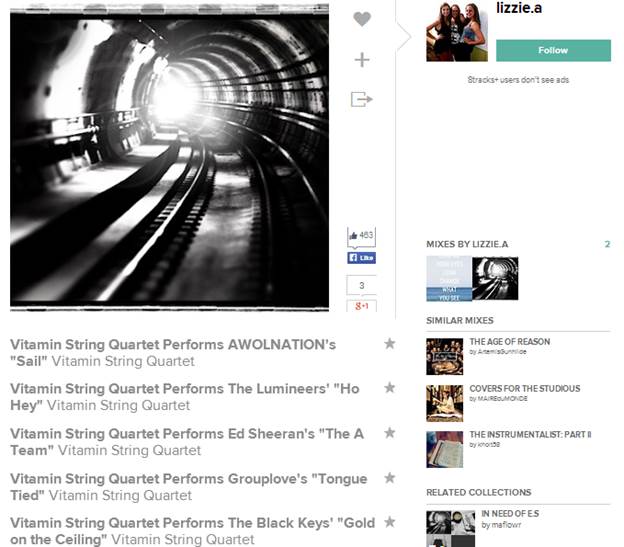
Where is `light`? The image size is (624, 547). light is located at coordinates (176, 102).